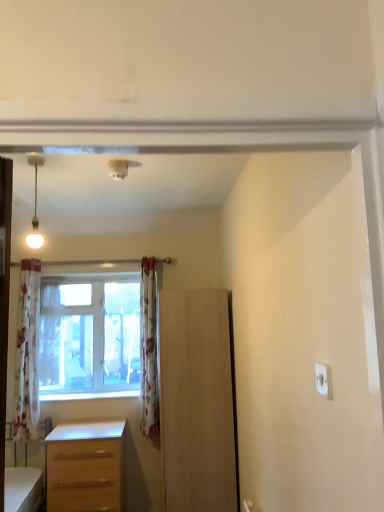
Question: Is matte white bulb at upper left in front of or behind white floral curtain at center, the second curtain from the right, in the image?

Choices:
 (A) front
 (B) behind

Answer: (A)

Question: Looking at their shapes, would you say matte white bulb at upper left is wider or thinner than white floral curtain at center, the second curtain from the right?

Choices:
 (A) wide
 (B) thin

Answer: (B)

Question: Which object is positioned closest to the light brown wood cabinet at center?

Choices:
 (A) white plastic electric outlet at upper right
 (B) matte white bulb at upper left
 (C) white glossy window sill at center
 (D) floral fabric curtain at center, the third curtain in the left-to-right sequence
 (E) light brown wooden desk at lower left

Answer: (D)

Question: Which of these objects is positioned closest to the floral fabric curtain at left, positioned as the third curtain in right-to-left order?

Choices:
 (A) light brown wooden desk at lower left
 (B) light brown wood cabinet at center
 (C) white glossy window sill at center
 (D) floral fabric curtain at center, positioned as the first curtain in right-to-left order
 (E) matte white bulb at upper left

Answer: (C)